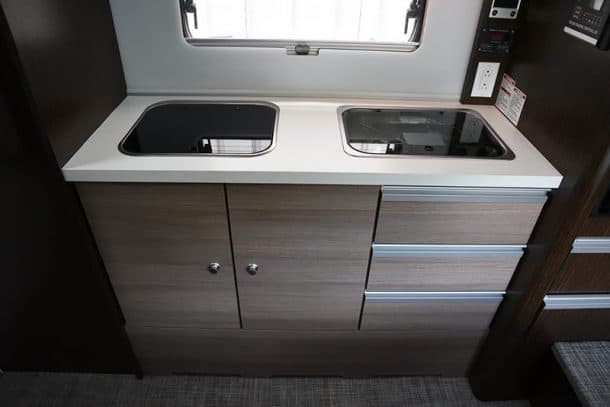
Find the location of a particular element. This screenshot has height=407, width=610. handle is located at coordinates tap(414, 10).